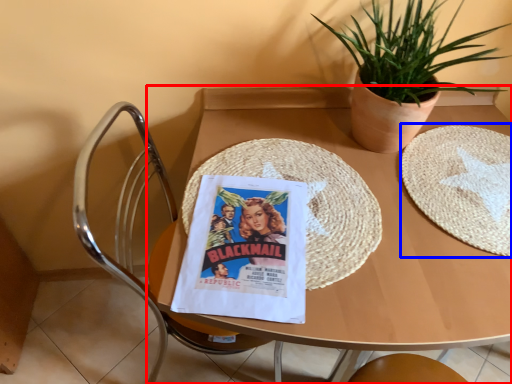
Question: Which object is closer to the camera taking this photo, table (highlighted by a red box) or paper plate (highlighted by a blue box)?

Choices:
 (A) table
 (B) paper plate

Answer: (A)